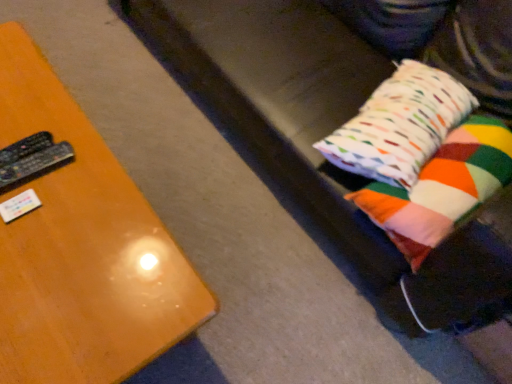
Locate an element on the screen. free spot behind black plastic remote at left, placed as the second remote when sorted from top to bottom is located at coordinates (45, 116).